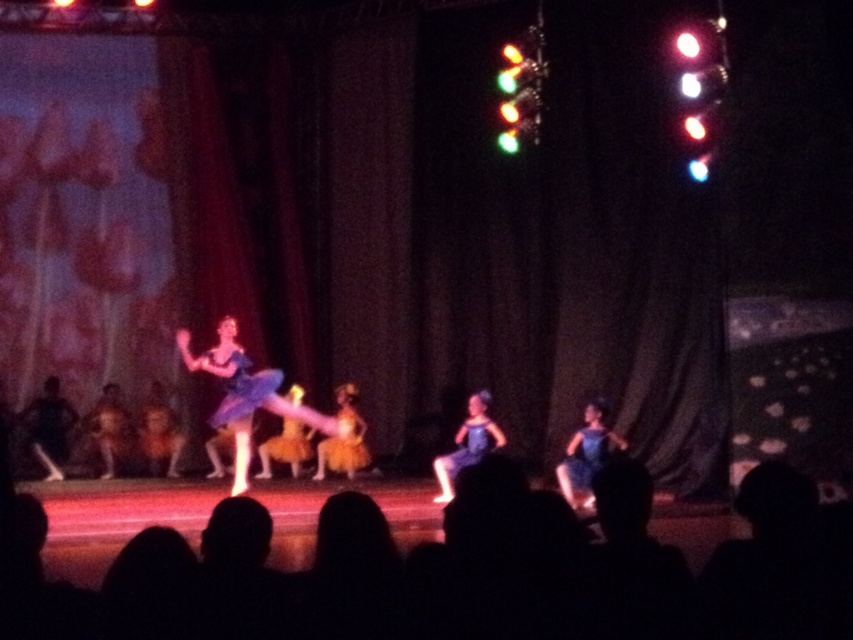
Question: Is matte blue dress at center wider than matte black dress at center?

Choices:
 (A) no
 (B) yes

Answer: (B)

Question: Which object appears farthest from the camera in this image?

Choices:
 (A) matte blue dress at center
 (B) matte black dress at center

Answer: (B)

Question: Is matte blue dress at center wider than matte black dress at center?

Choices:
 (A) yes
 (B) no

Answer: (A)

Question: Can you confirm if matte blue dress at center is smaller than matte black dress at center?

Choices:
 (A) yes
 (B) no

Answer: (B)